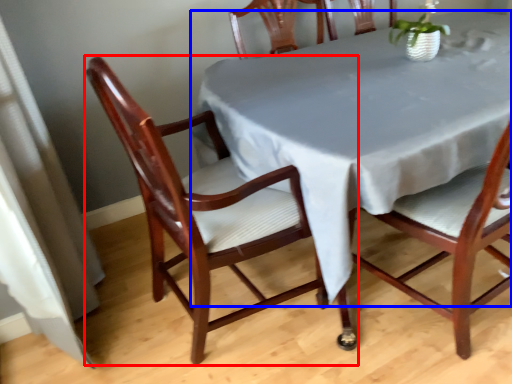
Question: Which object is closer to the camera taking this photo, chair (highlighted by a red box) or table (highlighted by a blue box)?

Choices:
 (A) chair
 (B) table

Answer: (A)